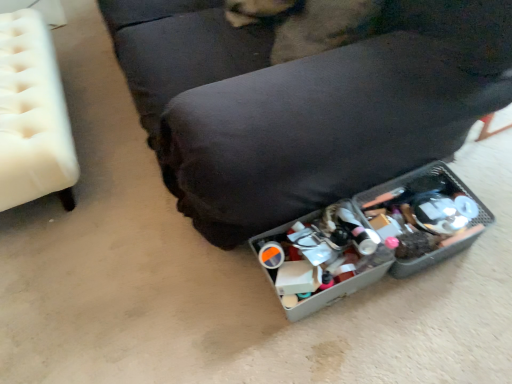
Question: Considering the relative positions of metallic gray storage bin at lower right, which appears as the 1th furniture when viewed from the right, and fuzzy brown dog at center in the image provided, is metallic gray storage bin at lower right, which appears as the 1th furniture when viewed from the right, to the left or to the right of fuzzy brown dog at center?

Choices:
 (A) right
 (B) left

Answer: (B)

Question: Relative to fuzzy brown dog at center, is metallic gray storage bin at lower right, the 2th furniture from the left, in front or behind?

Choices:
 (A) behind
 (B) front

Answer: (B)

Question: Based on their relative distances, which object is farther from the metallic gray storage bin at lower right, which appears as the 1th furniture when viewed from the right?

Choices:
 (A) white tufted ottoman at left, which is the first furniture from left to right
 (B) fuzzy brown dog at center

Answer: (A)

Question: Which object is positioned farthest from the metallic gray storage bin at lower right, which appears as the 1th furniture when viewed from the right?

Choices:
 (A) fuzzy brown dog at center
 (B) white tufted ottoman at left, which appears as the second furniture when viewed from the right

Answer: (B)